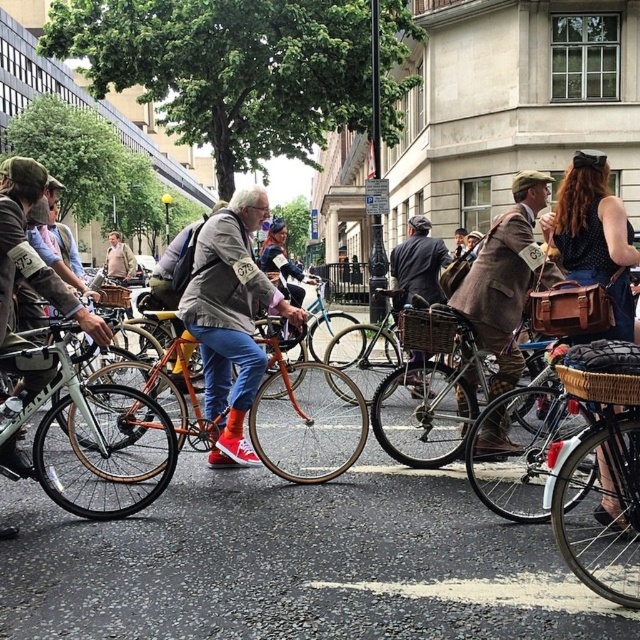
Does brown leather bag at right have a larger size compared to brown leather jacket at center?

Indeed, brown leather bag at right has a larger size compared to brown leather jacket at center.

Is point (593, 262) positioned in front of point (420, 234)?

Yes, it is.

Find the location of a particular element. Image resolution: width=640 pixels, height=640 pixels. brown leather bag at right is located at coordinates (595, 240).

Between brown leather jacket at center and brown woven basket at lower right, which one appears on the right side from the viewer's perspective?

From the viewer's perspective, brown leather jacket at center appears more on the right side.

Based on the photo, which is above, brown leather jacket at center or brown woven basket at lower right?

brown leather jacket at center

Which is behind, point (440, 243) or point (598, 388)?

The point (440, 243) is behind.

The height and width of the screenshot is (640, 640). Find the location of `brown leather jacket at center`. brown leather jacket at center is located at coordinates (417, 264).

Is point (397, 259) closer to camera compared to point (420, 321)?

No, it is behind (420, 321).

Can you confirm if brown leather jacket at center is positioned to the right of wooden woven basket at center?

Indeed, brown leather jacket at center is positioned on the right side of wooden woven basket at center.

Is point (412, 394) more distant than point (436, 324)?

Yes, point (412, 394) is farther from viewer.

Image resolution: width=640 pixels, height=640 pixels. What are the coordinates of `brown leather jacket at center` in the screenshot? It's located at (417, 264).